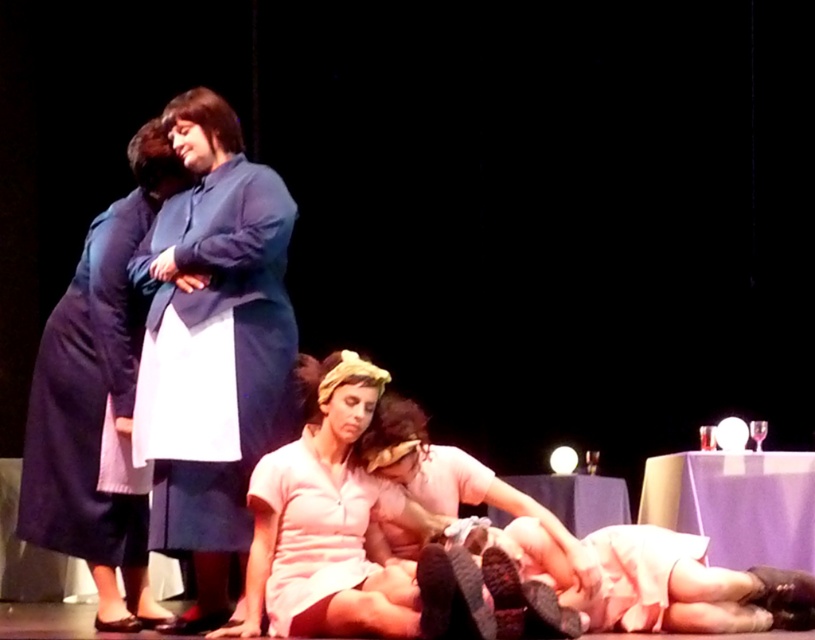
Does blue fabric coat at upper left appear under white matte dress at center?

Incorrect, blue fabric coat at upper left is not positioned below white matte dress at center.

From the picture: Does blue fabric coat at upper left have a smaller size compared to white matte dress at center?

Correct, blue fabric coat at upper left occupies less space than white matte dress at center.

The image size is (815, 640). I want to click on blue fabric coat at upper left, so click(x=212, y=346).

Identify the location of blue fabric coat at upper left. (212, 346).

Can you confirm if white matte dress at center is smaller than pink satin dress at lower center?

Yes.

Does white matte dress at center appear on the right side of pink satin dress at lower center?

In fact, white matte dress at center is to the left of pink satin dress at lower center.

Which is in front, point (313, 433) or point (595, 564)?

Point (595, 564) is in front.

You are a GUI agent. You are given a task and a screenshot of the screen. Output one action in this format:
    pyautogui.click(x=<x>, y=<y>)
    Task: Click on the white matte dress at center
    Image resolution: width=815 pixels, height=640 pixels.
    Given the screenshot: What is the action you would take?
    pyautogui.click(x=346, y=531)

The image size is (815, 640). What do you see at coordinates (346, 531) in the screenshot? I see `white matte dress at center` at bounding box center [346, 531].

Does white matte dress at center have a larger size compared to matte blue dress at upper left?

Yes.

Is point (355, 484) farther from viewer compared to point (137, 292)?

No, (355, 484) is closer to viewer.

Where is `white matte dress at center`? This screenshot has width=815, height=640. white matte dress at center is located at coordinates (346, 531).